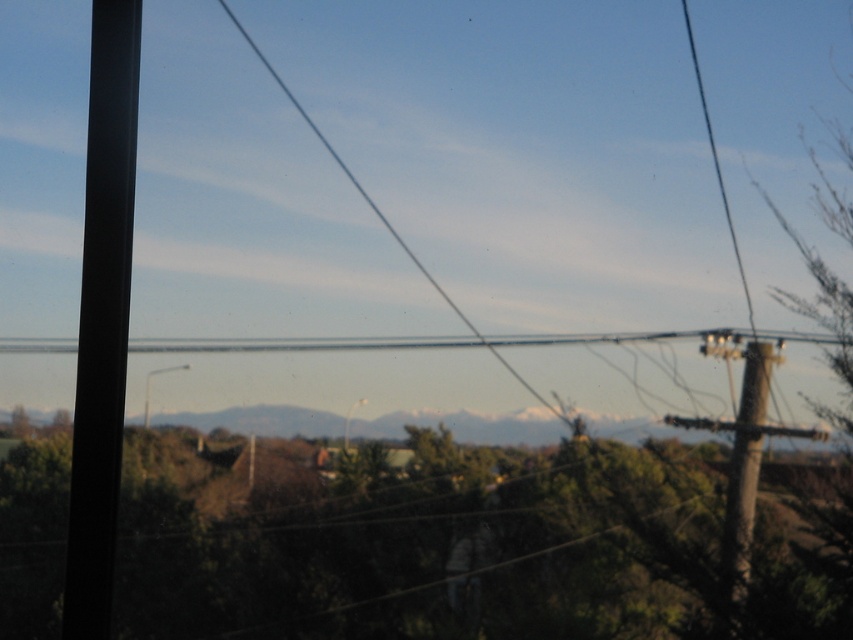
This screenshot has height=640, width=853. What do you see at coordinates (419, 541) in the screenshot?
I see `green leafy tree at center` at bounding box center [419, 541].

Which is more to the left, green leafy tree at center or brown rough wood telegraph pole at right?

green leafy tree at center is more to the left.

Is point (693, 515) less distant than point (727, 538)?

No.

Find the location of a particular element. green leafy tree at center is located at coordinates (419, 541).